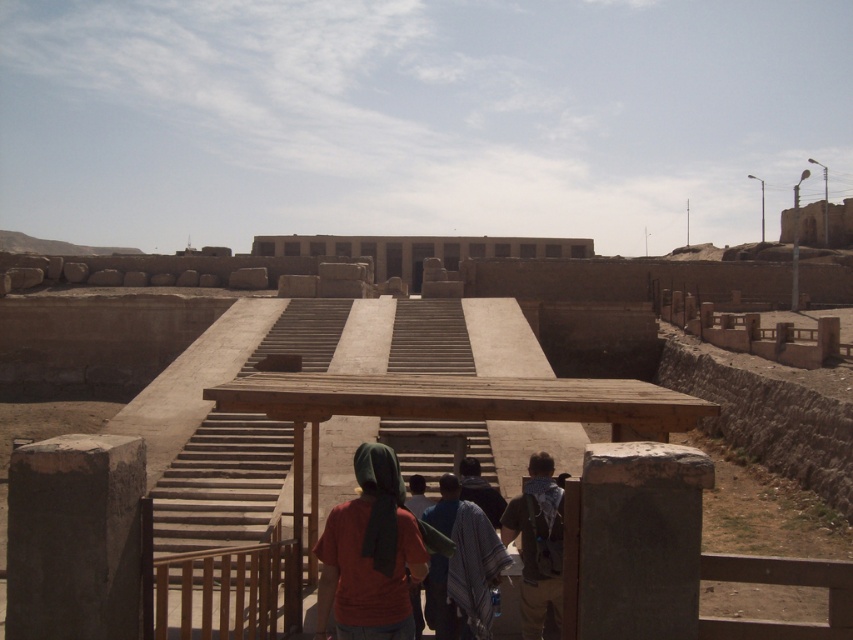
You are a tour guide leading a group at this archaeological site. You notice two visitors wearing a matte red shirt at center and a blue striped shawl at center. Your group is standing 3 meters away from both of them. Can you safely walk between the two visitors to reach the stone steps without getting too close?

The distance between the matte red shirt at center and blue striped shawl at center is 2.18 meters. Since you need to walk through this space, and considering an average person occupies about 0.5 meters in width, there would still be 1.68 meters of space remaining. This leaves enough room to pass comfortably without getting too close to either visitor. Yes, you can safely walk between them.

You are a tour guide at the archaeological site and need to ensure visitors can distinguish between the two items at the center of the scene. Which item is narrower, the matte red shirt at center or the blue striped shawl at center?

The matte red shirt at center is narrower than the blue striped shawl at center.